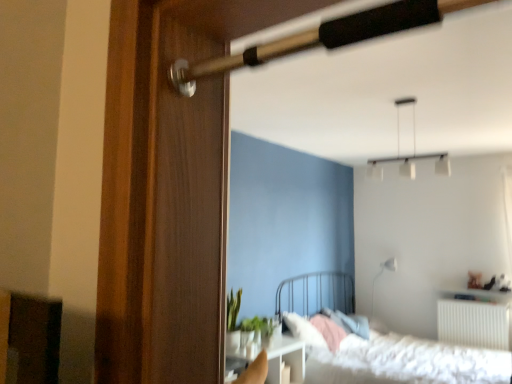
This screenshot has height=384, width=512. Identify the location of empty space that is ontop of white matte pendant light at upper center, the 1th lamp from the top (from a real-world perspective). (408, 99).